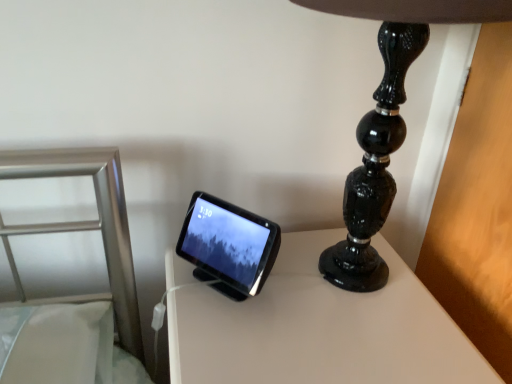
Where is `free space in front of matte black tablet at center`? free space in front of matte black tablet at center is located at coordinates (237, 330).